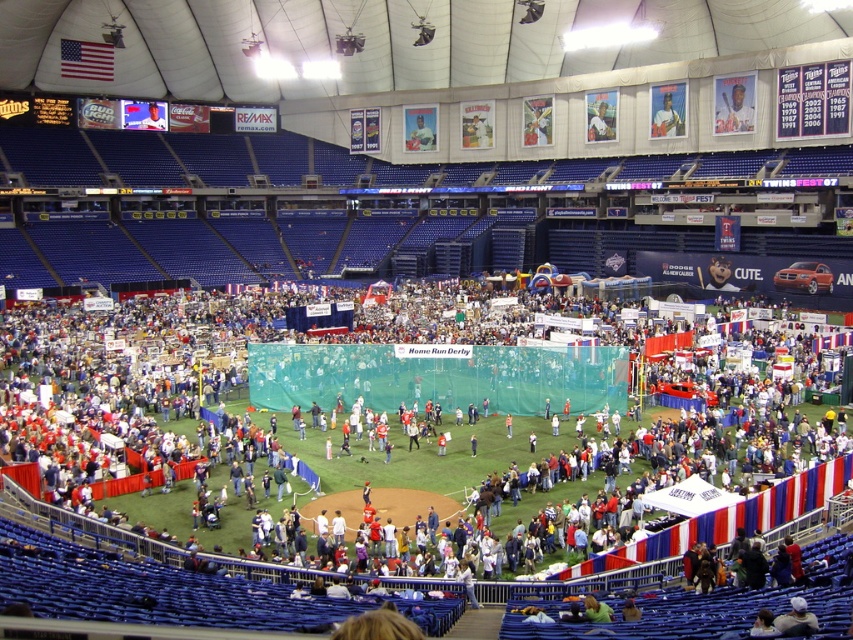
You are a photographer standing at the back of the arena. You want to take a photo of the smooth plastic figure at center without the light blue fabric at upper center blocking it. Is this possible?

The light blue fabric at upper center is in front of the smooth plastic figure at center, so it will block the view. Move to a position where the smooth plastic figure at center is between you and the light blue fabric at upper center to avoid the obstruction.

You are a photographer positioned at the edge of the central green field. You want to capture a photo that includes both the light blue fabric at upper center and the smooth plastic figure at center. Based on their positions, which object should you adjust your camera angle to include first?

Answer: The light blue fabric at upper center is to the right of the smooth plastic figure at center, so you should adjust your camera angle to include the smooth plastic figure at center first, then pan right to include the light blue fabric at upper center.

You are a photographer positioned at the light blue fabric at upper center and want to capture a wide shot of the Home Run Derby event happening at the central green field. Your camera has a maximum zoom range of 100 meters. Can your camera capture the entire event area clearly?

The light blue fabric at upper center and camera are 93.72 meters apart. Since the camera has a maximum zoom range of 100 meters, it can capture the entire event area clearly as the distance is within the zoom range.